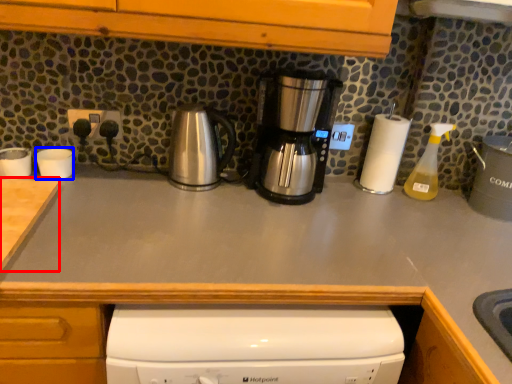
Question: Which point is closer to the camera, counter top (highlighted by a red box) or appliance (highlighted by a blue box)?

Choices:
 (A) counter top
 (B) appliance

Answer: (A)